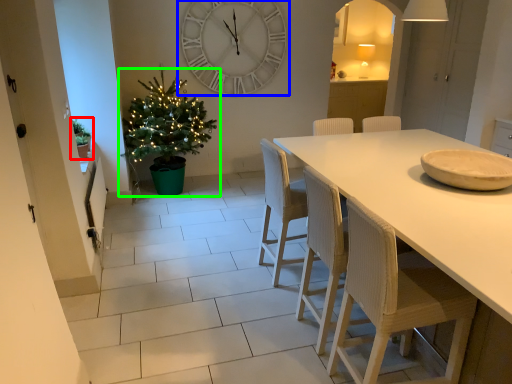
Question: Based on their relative distances, which object is nearer to houseplant (highlighted by a red box)? Choose from wall clock (highlighted by a blue box) and christmas tree (highlighted by a green box).

Choices:
 (A) wall clock
 (B) christmas tree

Answer: (B)